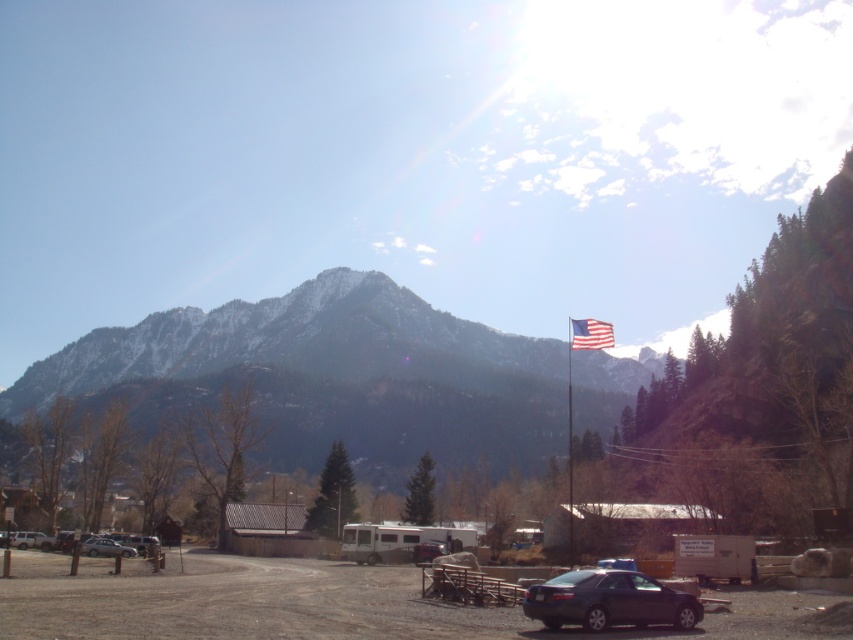
Is metallic flag pole at upper center to the left of american flag at center from the viewer's perspective?

No, metallic flag pole at upper center is not to the left of american flag at center.

Does point (573, 346) come behind point (595, 324)?

No, (573, 346) is in front of (595, 324).

Where is `metallic flag pole at upper center`? metallic flag pole at upper center is located at coordinates pos(572,392).

Which is more to the right, silver metallic sedan at lower left or metallic silver car at center?

metallic silver car at center is more to the right.

Is silver metallic sedan at lower left wider than metallic silver car at center?

Yes.

The image size is (853, 640). In order to click on silver metallic sedan at lower left in this screenshot , I will do `click(105, 547)`.

Does brown dirt track at lower center have a lesser width compared to metallic blue sedan at lower right?

In fact, brown dirt track at lower center might be wider than metallic blue sedan at lower right.

Does brown dirt track at lower center appear under metallic blue sedan at lower right?

Yes, brown dirt track at lower center is below metallic blue sedan at lower right.

The image size is (853, 640). Identify the location of brown dirt track at lower center. (326, 604).